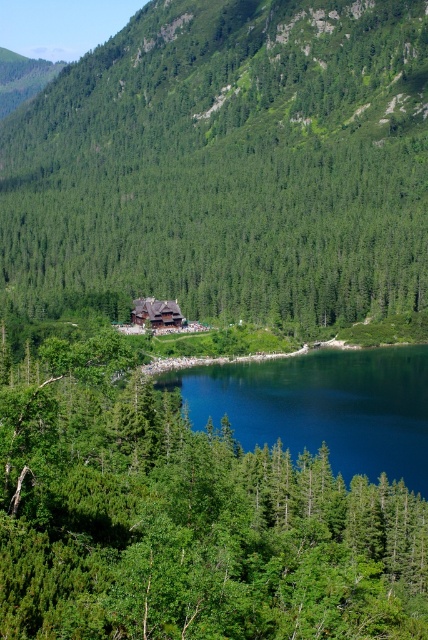
Question: Which is farther from the green matte tree at center?

Choices:
 (A) green leafy tree at center
 (B) wooden cabin at center

Answer: (A)

Question: Is green leafy tree at center bigger than wooden cabin at center?

Choices:
 (A) yes
 (B) no

Answer: (A)

Question: Considering the relative positions of green matte tree at center and green leafy tree at center in the image provided, where is green matte tree at center located with respect to green leafy tree at center?

Choices:
 (A) below
 (B) above

Answer: (B)

Question: Which object is farther from the camera taking this photo?

Choices:
 (A) wooden cabin at center
 (B) green leafy tree at center
 (C) deep blue water at center

Answer: (A)

Question: Considering the relative positions of green matte tree at center and green leafy tree at center in the image provided, where is green matte tree at center located with respect to green leafy tree at center?

Choices:
 (A) right
 (B) left

Answer: (B)

Question: Which object is the farthest from the green matte tree at center?

Choices:
 (A) wooden cabin at center
 (B) green leafy tree at center
 (C) deep blue water at center

Answer: (B)